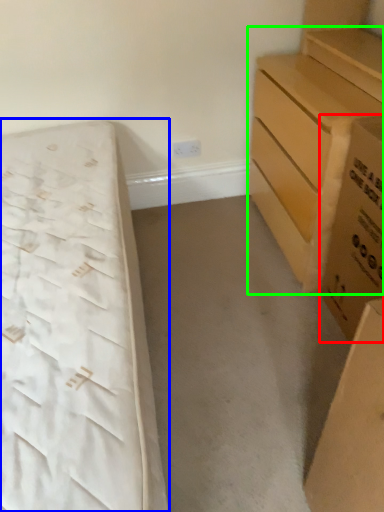
Question: Estimate the real-world distances between objects in this image. Which object is closer to cardboard box (highlighted by a red box), bed (highlighted by a blue box) or chest of drawers (highlighted by a green box)?

Choices:
 (A) bed
 (B) chest of drawers

Answer: (B)